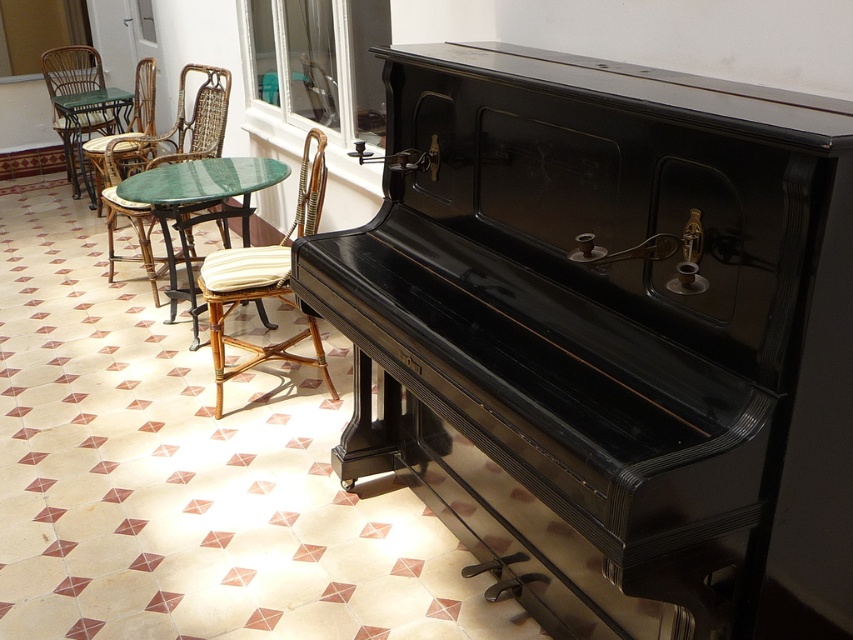
You are a guest at a party and need to sit down. You see a woven rattan chair with striped cushion at center and a woven rattan chair at left. Which chair is shorter in height?

The woven rattan chair with striped cushion at center is shorter in height than the woven rattan chair at left.

You are standing in the vintage room and want to determine which of the two points, point (221, 314) or point (149, 218), is closer to you. Can you identify the closer one?

Point (221, 314) is closer to the viewer than point (149, 218).

You are standing in the room and want to place a new plant pot exactly at the center of the room. The current center is occupied by the woven rattan chair with striped cushion at center. To determine if you need to move the chair, can you check if the chair is exactly at the center coordinates of the room?

The 2D location of the woven rattan chair with striped cushion at center is at point (265, 280), so it is not exactly at the center of the room. The center would be at coordinates (426, 320). Therefore, the chair is slightly to the left and down from the true center.